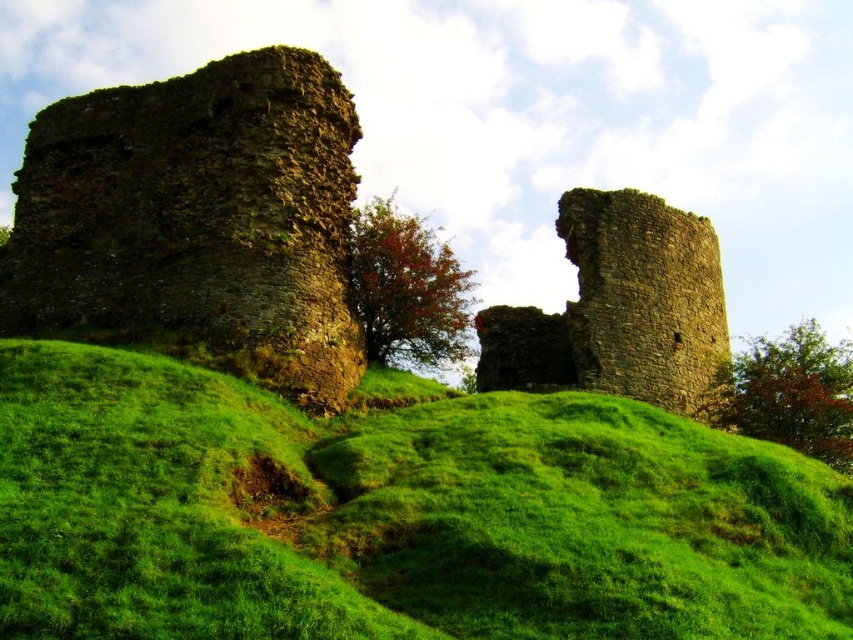
Question: Which object appears closest to the camera in this image?

Choices:
 (A) green grassy hillside at center
 (B) rustic stone castle at upper left

Answer: (A)

Question: Which point is farther to the camera?

Choices:
 (A) (62, 256)
 (B) (589, 342)
 (C) (184, 276)

Answer: (B)

Question: Can you confirm if green grassy hillside at center is positioned below rusty stone tower at left?

Choices:
 (A) yes
 (B) no

Answer: (A)

Question: Is green grassy hillside at center wider than rusty stone tower at left?

Choices:
 (A) yes
 (B) no

Answer: (A)

Question: Does green grassy hillside at center appear on the left side of rustic stone castle at upper left?

Choices:
 (A) no
 (B) yes

Answer: (A)

Question: Which object appears closest to the camera in this image?

Choices:
 (A) rusty stone tower at center
 (B) rustic stone castle at upper left

Answer: (B)